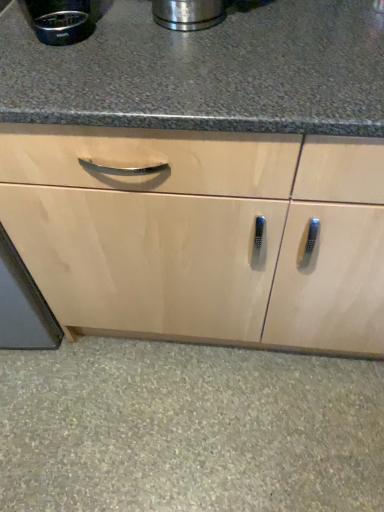
Question: Can you confirm if natural stone floor at lower center is positioned to the left of brushed metal coffee maker at upper left?

Choices:
 (A) yes
 (B) no

Answer: (B)

Question: Can you confirm if natural stone floor at lower center is thinner than brushed metal coffee maker at upper left?

Choices:
 (A) yes
 (B) no

Answer: (B)

Question: Is natural stone floor at lower center facing towards brushed metal coffee maker at upper left?

Choices:
 (A) yes
 (B) no

Answer: (B)

Question: Is natural stone floor at lower center positioned in front of brushed metal coffee maker at upper left?

Choices:
 (A) yes
 (B) no

Answer: (B)

Question: Is natural stone floor at lower center not within brushed metal coffee maker at upper left?

Choices:
 (A) no
 (B) yes

Answer: (B)

Question: Is natural stone floor at lower center far from brushed metal coffee maker at upper left?

Choices:
 (A) yes
 (B) no

Answer: (A)

Question: Is brushed metal coffee maker at upper left further to camera compared to natural stone floor at lower center?

Choices:
 (A) yes
 (B) no

Answer: (B)

Question: From a real-world perspective, is brushed metal coffee maker at upper left on natural stone floor at lower center?

Choices:
 (A) no
 (B) yes

Answer: (B)

Question: Is brushed metal coffee maker at upper left positioned far away from natural stone floor at lower center?

Choices:
 (A) yes
 (B) no

Answer: (A)

Question: Is the surface of brushed metal coffee maker at upper left in direct contact with natural stone floor at lower center?

Choices:
 (A) no
 (B) yes

Answer: (A)

Question: Is brushed metal coffee maker at upper left at the right side of natural stone floor at lower center?

Choices:
 (A) no
 (B) yes

Answer: (A)

Question: Is brushed metal coffee maker at upper left positioned before natural stone floor at lower center?

Choices:
 (A) yes
 (B) no

Answer: (A)

Question: Is point (48, 458) closer or farther from the camera than point (51, 6)?

Choices:
 (A) farther
 (B) closer

Answer: (A)